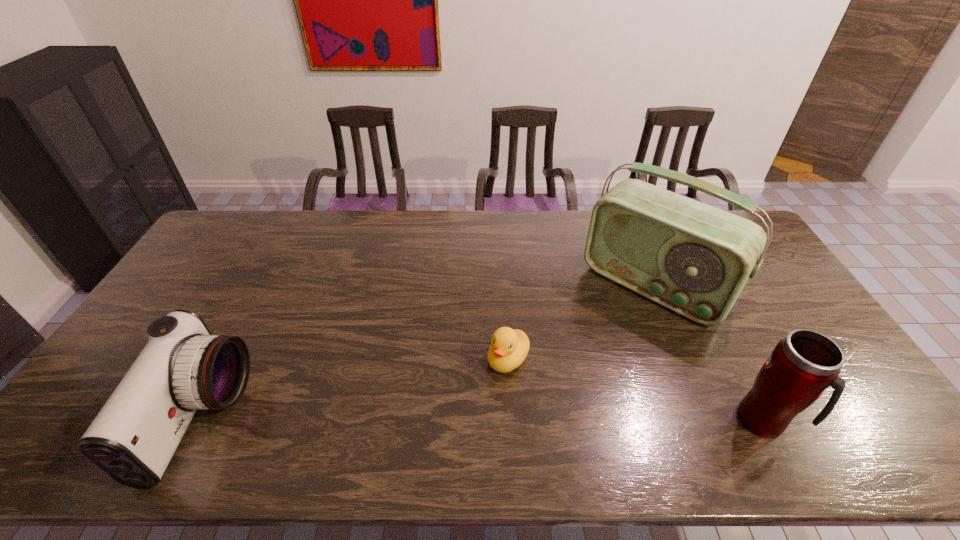
You are a GUI agent. You are given a task and a screenshot of the screen. Output one action in this format:
    pyautogui.click(x=<x>, y=<y>)
    Task: Click on the object that ranks as the closest to the thermos bottle
    This screenshot has height=540, width=960.
    Given the screenshot: What is the action you would take?
    pyautogui.click(x=692, y=258)

You are a GUI agent. You are given a task and a screenshot of the screen. Output one action in this format:
    pyautogui.click(x=<x>, y=<y>)
    Task: Click on the object that stands as the closest to the leftmost object
    
    Given the screenshot: What is the action you would take?
    pyautogui.click(x=509, y=347)

Identify the location of vacant region that satisfies the following two spatial constraints: 1. on the front side of the second tallest object; 2. on the side with the handle of the duckling. pyautogui.click(x=512, y=421).